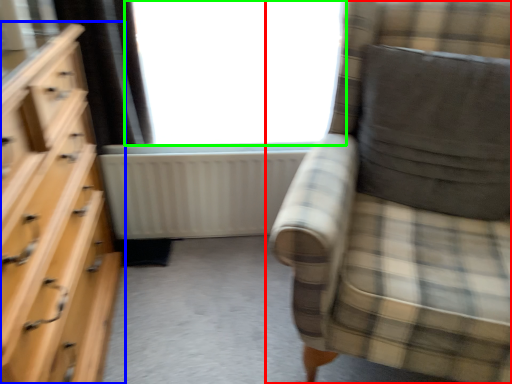
Question: Which object is the closest to the chair (highlighted by a red box)? Choose among these: chest of drawers (highlighted by a blue box) or window (highlighted by a green box).

Choices:
 (A) chest of drawers
 (B) window

Answer: (B)